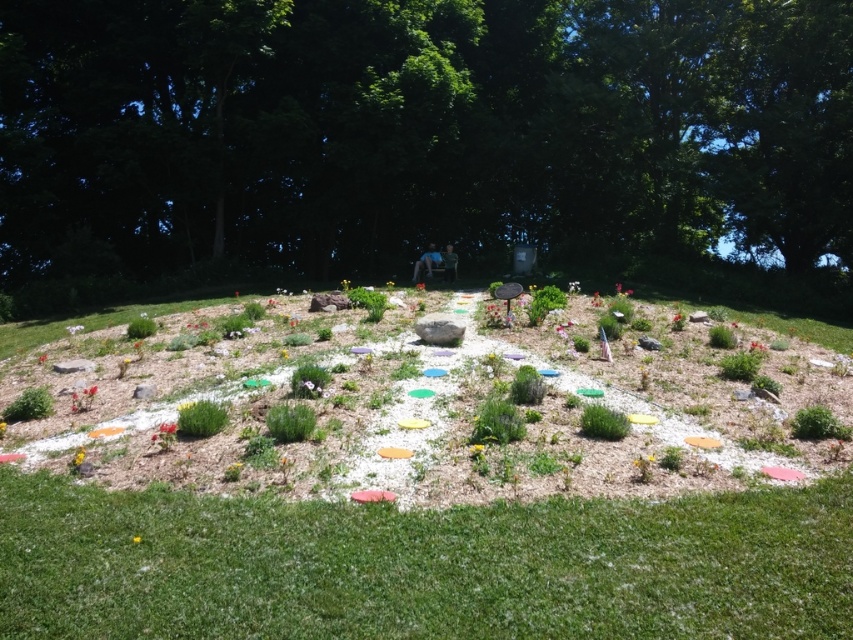
Is green leafy tree at center positioned behind green grass at lower center?

Yes, it is.

Which is in front, point (746, 160) or point (422, 545)?

Positioned in front is point (422, 545).

You are a GUI agent. You are given a task and a screenshot of the screen. Output one action in this format:
    pyautogui.click(x=<x>, y=<y>)
    Task: Click on the green leafy tree at center
    This screenshot has width=853, height=640.
    Given the screenshot: What is the action you would take?
    pyautogui.click(x=416, y=131)